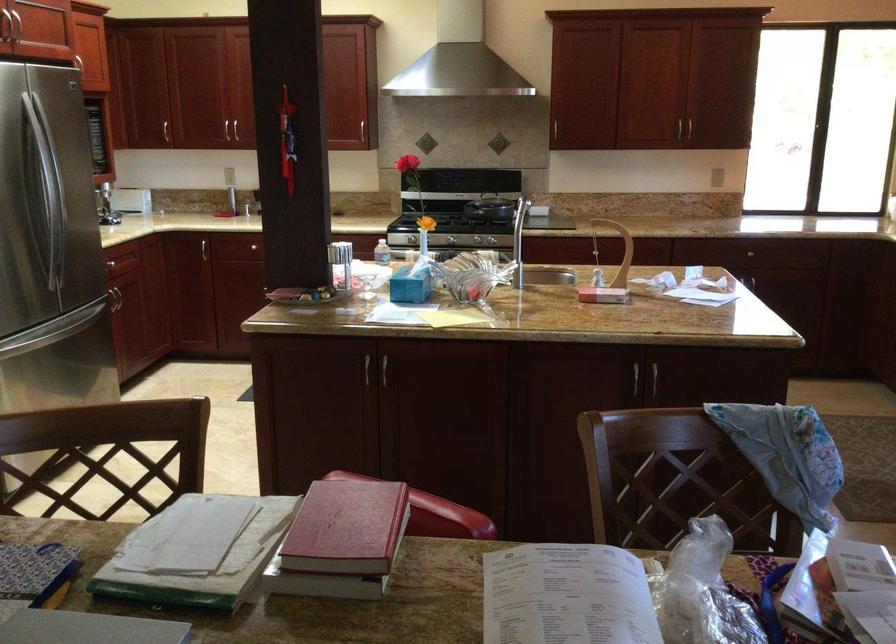
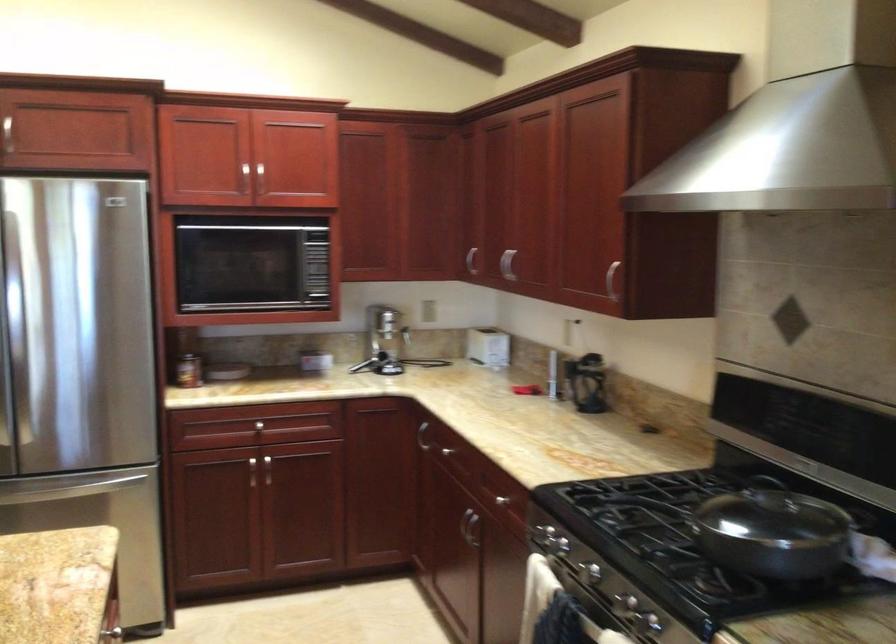
Question: I am providing you with two images of the same scene from different viewpoints. Please identify which objects are invisible in image2.

Choices:
 (A) refrigerator handle
 (B) silver cabinet handle
 (C) white plant pot
 (D) silver stovetop knob

Answer: (B)